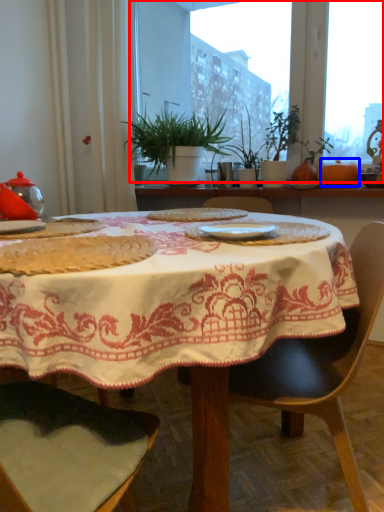
Question: Which object is closer to the camera taking this photo, window screen (highlighted by a red box) or pumpkin (highlighted by a blue box)?

Choices:
 (A) window screen
 (B) pumpkin

Answer: (A)